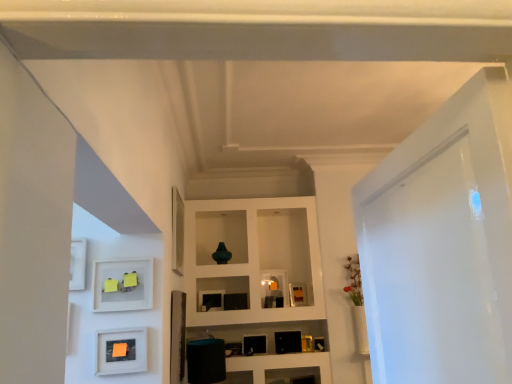
Question: Does white matte frame at lower left have a larger size compared to matte orange paper at lower left, which is the 3th picture frame from back to front?

Choices:
 (A) yes
 (B) no

Answer: (A)

Question: Can you confirm if white matte frame at lower left is positioned to the left of matte orange paper at lower left, which is the 3th picture frame from back to front?

Choices:
 (A) yes
 (B) no

Answer: (A)

Question: Is white matte frame at lower left located outside matte orange paper at lower left, which appears as the 1th picture frame when viewed from the front?

Choices:
 (A) yes
 (B) no

Answer: (A)

Question: Considering the relative positions of white matte frame at lower left and matte orange paper at lower left, arranged as the 1th picture frame when viewed from the left, in the image provided, is white matte frame at lower left behind matte orange paper at lower left, arranged as the 1th picture frame when viewed from the left,?

Choices:
 (A) yes
 (B) no

Answer: (A)

Question: Can you confirm if white matte frame at lower left is thinner than matte orange paper at lower left, arranged as the 1th picture frame when viewed from the left?

Choices:
 (A) no
 (B) yes

Answer: (B)

Question: Could you tell me if white matte frame at lower left is facing matte orange paper at lower left, arranged as the 1th picture frame when viewed from the left?

Choices:
 (A) yes
 (B) no

Answer: (B)

Question: Is matte black picture frame at center, which appears as the 1th picture frame when viewed from the right, facing towards matte white picture frame at center, positioned as the 2th picture frame in front-to-back order?

Choices:
 (A) yes
 (B) no

Answer: (B)

Question: Is the depth of matte black picture frame at center, the first picture frame from the back, less than that of matte white picture frame at center, positioned as the 2th picture frame in front-to-back order?

Choices:
 (A) no
 (B) yes

Answer: (A)

Question: Considering the relative sizes of matte black picture frame at center, the third picture frame positioned from the left, and matte white picture frame at center, positioned as the 2th picture frame in front-to-back order, in the image provided, is matte black picture frame at center, the third picture frame positioned from the left, shorter than matte white picture frame at center, positioned as the 2th picture frame in front-to-back order,?

Choices:
 (A) no
 (B) yes

Answer: (B)

Question: From the image's perspective, is matte black picture frame at center, which ranks as the third picture frame in front-to-back order, over matte white picture frame at center, placed as the 2th picture frame when sorted from right to left?

Choices:
 (A) no
 (B) yes

Answer: (A)

Question: Can you confirm if matte black picture frame at center, the first picture frame from the back, is wider than matte white picture frame at center, the 2th picture frame from the back?

Choices:
 (A) no
 (B) yes

Answer: (B)

Question: Does matte black picture frame at center, the first picture frame from the back, have a greater height compared to matte white picture frame at center, acting as the 2th picture frame starting from the left?

Choices:
 (A) yes
 (B) no

Answer: (B)

Question: From a real-world perspective, is white glossy door at right positioned over white matte frame at lower left based on gravity?

Choices:
 (A) yes
 (B) no

Answer: (B)